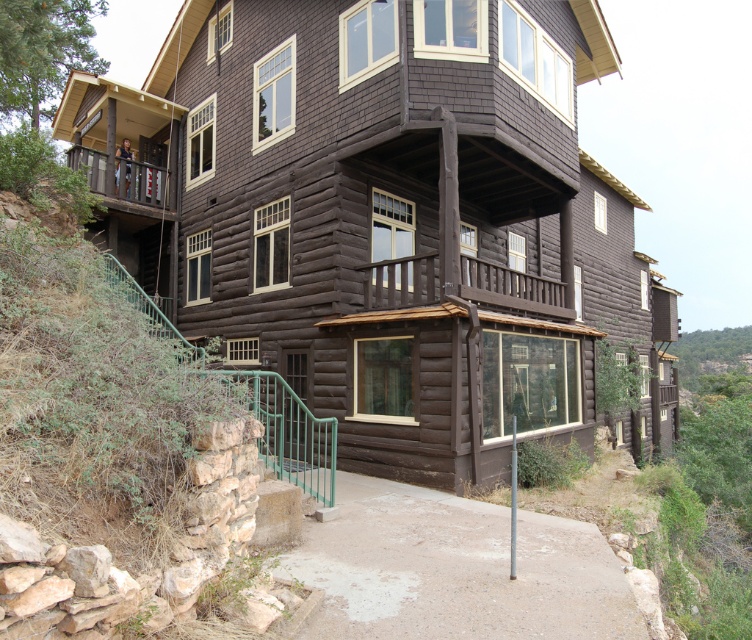
Can you confirm if brown wooden porch at center is positioned to the left of brown wooden porch at upper left?

No, brown wooden porch at center is not to the left of brown wooden porch at upper left.

Does brown wooden porch at center appear on the right side of brown wooden porch at upper left?

Correct, you'll find brown wooden porch at center to the right of brown wooden porch at upper left.

Where is `brown wooden porch at center`? The width and height of the screenshot is (752, 640). brown wooden porch at center is located at coordinates (459, 285).

In order to click on brown wooden porch at center in this screenshot , I will do (459, 285).

Between dark wood cabin at center and brown wooden porch at upper left, which one has more height?

dark wood cabin at center is taller.

Is point (381, 38) positioned after point (123, 163)?

No, (381, 38) is closer to viewer.

Who is more forward, (302, 68) or (123, 164)?

Point (302, 68) is in front.

Where is `dark wood cabin at center`? This screenshot has width=752, height=640. dark wood cabin at center is located at coordinates (411, 221).

Is dark wood cabin at center to the left of brown wooden porch at center from the viewer's perspective?

Incorrect, dark wood cabin at center is not on the left side of brown wooden porch at center.

Between dark wood cabin at center and brown wooden porch at center, which one has more height?

dark wood cabin at center is taller.

Does point (362, 0) come closer to viewer compared to point (384, 305)?

No, (362, 0) is further to viewer.

Locate an element on the screen. The image size is (752, 640). dark wood cabin at center is located at coordinates (411, 221).